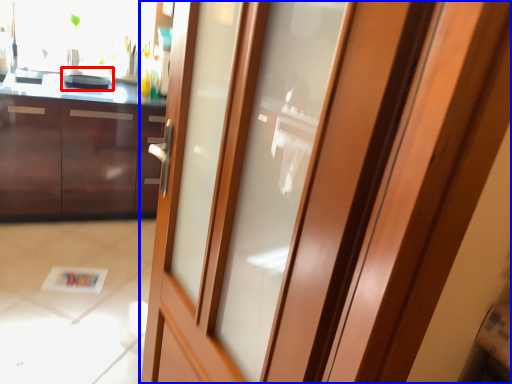
Question: Which object is further to the camera taking this photo, appliance (highlighted by a red box) or door (highlighted by a blue box)?

Choices:
 (A) appliance
 (B) door

Answer: (A)